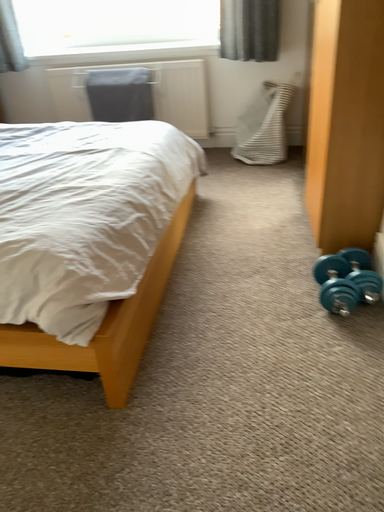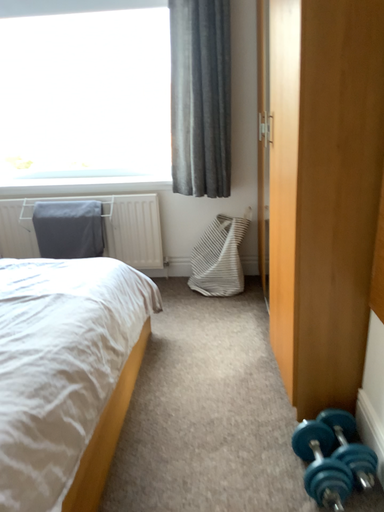
Question: Which way did the camera rotate in the video?

Choices:
 (A) rotated upward
 (B) rotated downward

Answer: (A)